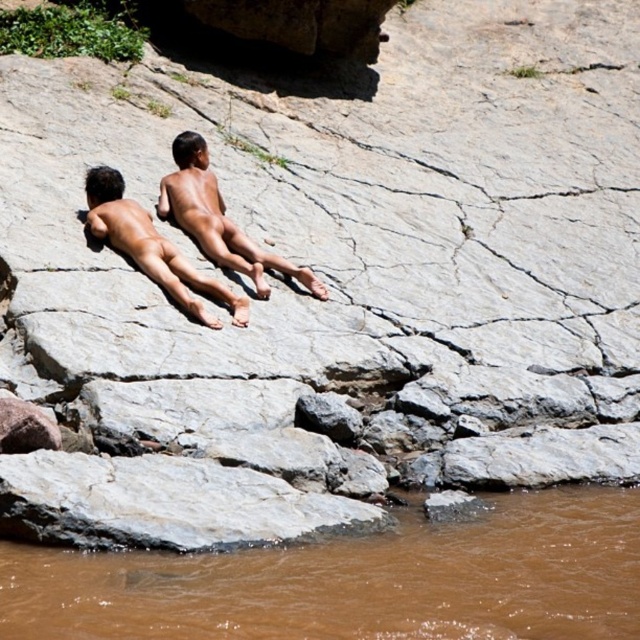
Question: Which object is the farthest from the matte skin man at center?

Choices:
 (A) brown skin boy at center
 (B) brown muddy water at lower left

Answer: (B)

Question: Does brown muddy water at lower left have a greater width compared to brown skin boy at center?

Choices:
 (A) no
 (B) yes

Answer: (B)

Question: Among these points, which one is farthest from the camera?

Choices:
 (A) (54, 573)
 (B) (304, 275)

Answer: (B)

Question: Can you confirm if brown muddy water at lower left is positioned below brown skin boy at center?

Choices:
 (A) no
 (B) yes

Answer: (B)

Question: Which is nearer to the matte skin man at center?

Choices:
 (A) brown skin boy at center
 (B) brown muddy water at lower left

Answer: (A)

Question: Considering the relative positions of matte skin man at center and brown skin boy at center in the image provided, where is matte skin man at center located with respect to brown skin boy at center?

Choices:
 (A) above
 (B) below

Answer: (A)